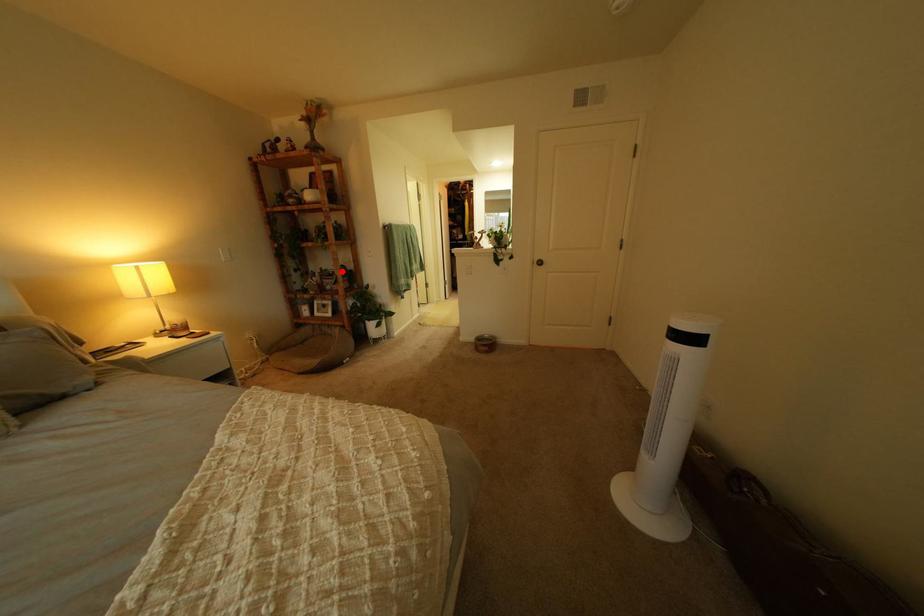
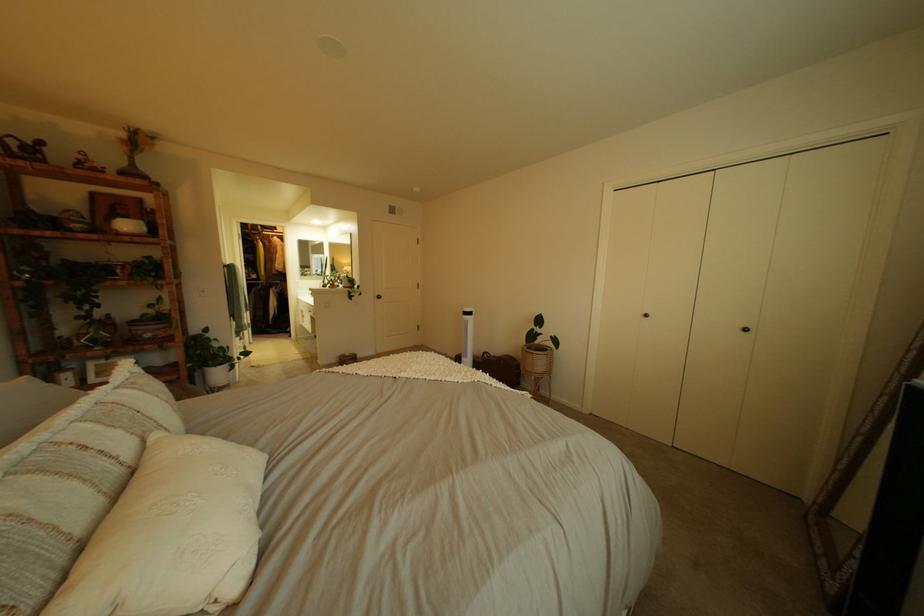
Question: I am providing you with two images of the same scene from different viewpoints. A red point is shown in image1. For the corresponding object point in image2, is it positioned nearer or farther from the camera?

Choices:
 (A) Nearer
 (B) Farther

Answer: (B)